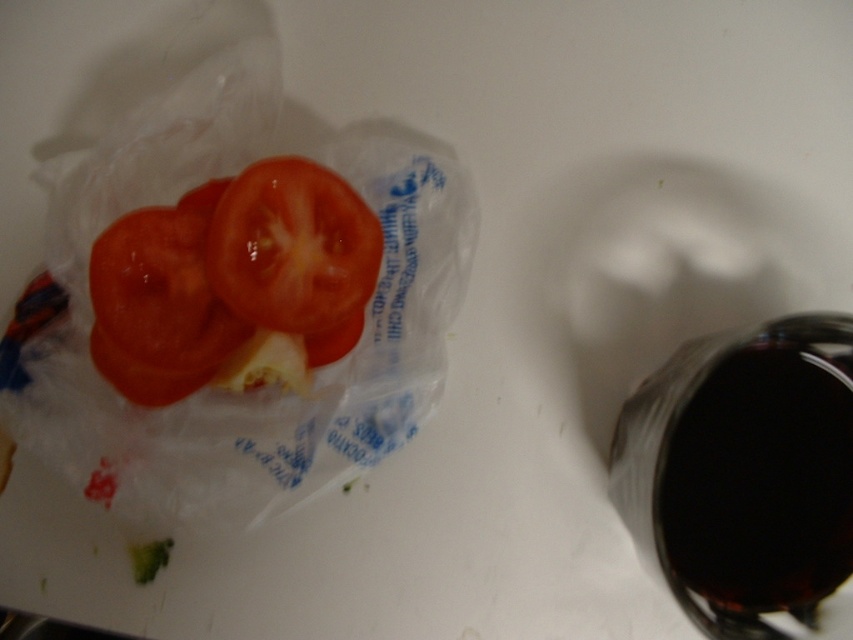
You are trying to pack the shiny red tomato at left and the shiny red tomato at center into a container that can only fit the wider one. Which tomato should you choose?

You should choose the shiny red tomato at left because it might be wider than the shiny red tomato at center according to the description.

You are organizing a picnic basket and see the shiny red tomato at left and the shiny red tomato at center in the bag. Which tomato is located to the right of the other?

The shiny red tomato at center is located to the right of the shiny red tomato at left.